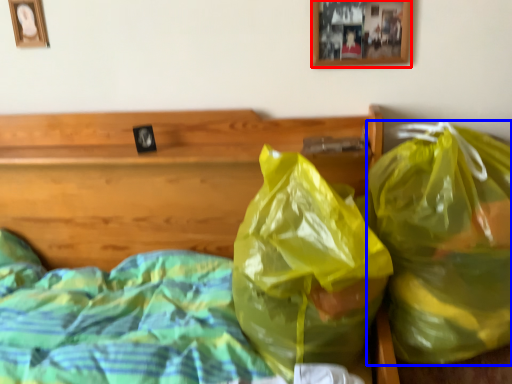
Question: Which object is further to the camera taking this photo, picture frame (highlighted by a red box) or plastic bag (highlighted by a blue box)?

Choices:
 (A) picture frame
 (B) plastic bag

Answer: (A)